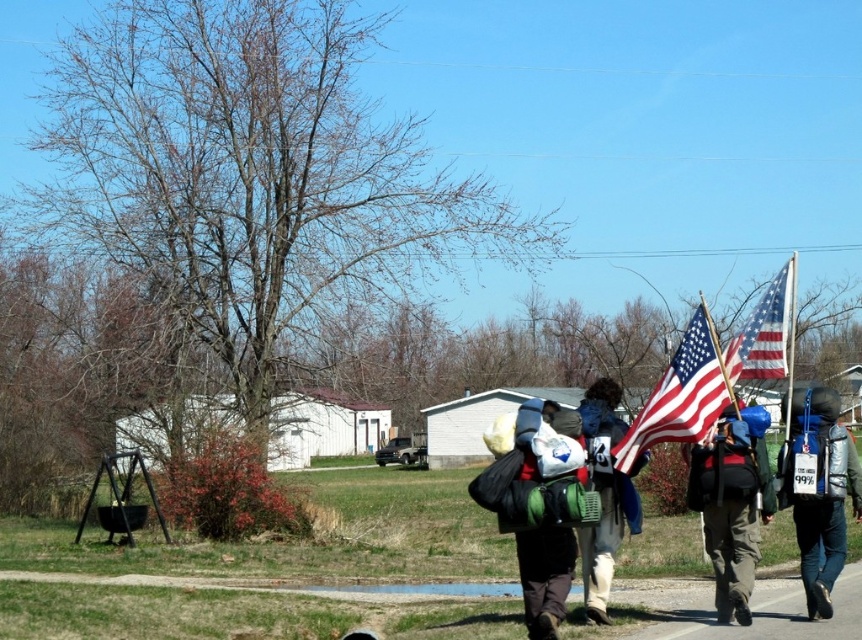
You are a photographer trying to capture a photo of the silver metallic backpack at right and the american flag at center. Considering their sizes, which object should you focus on first to ensure both are in frame without moving the camera?

The silver metallic backpack at right is much taller than the american flag at center, so you should focus on the silver metallic backpack at right first to ensure both fit in the frame without moving the camera.